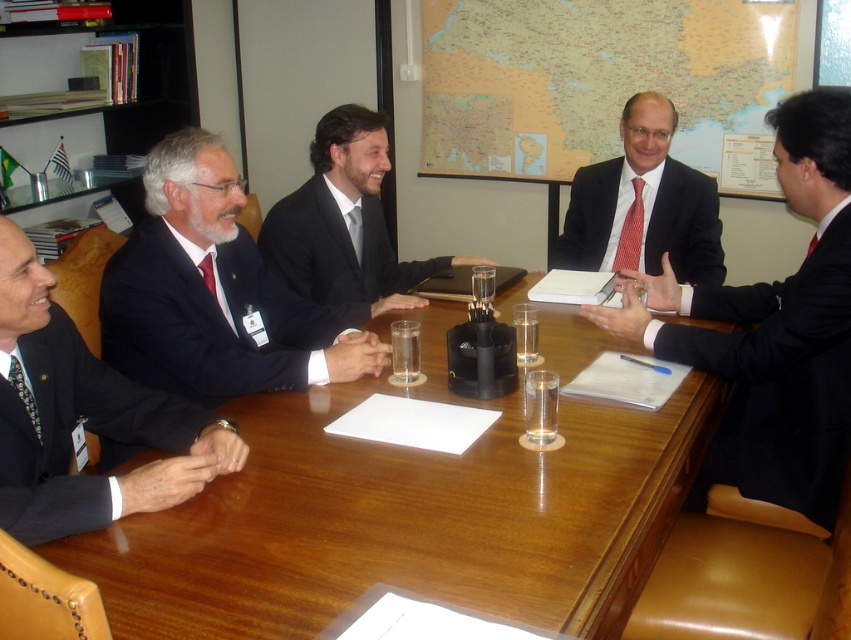
Question: Is matte black suit at left smaller than black suit at center?

Choices:
 (A) no
 (B) yes

Answer: (A)

Question: Which of the following is the farthest from the observer?

Choices:
 (A) black suit at center
 (B) red dotted tie at center
 (C) dark blue suit at left
 (D) wooden table at center

Answer: (B)

Question: Does wooden table at center appear on the right side of dark blue suit at left?

Choices:
 (A) no
 (B) yes

Answer: (B)

Question: Based on their relative distances, which object is nearer to the wooden table at center?

Choices:
 (A) dark blue suit at left
 (B) matte black suit at center
 (C) red dotted tie at center

Answer: (A)

Question: Is matte black suit at center thinner than matte black suit at left?

Choices:
 (A) yes
 (B) no

Answer: (A)

Question: Among these points, which one is farthest from the camera?

Choices:
 (A) (610, 182)
 (B) (824, 182)

Answer: (A)